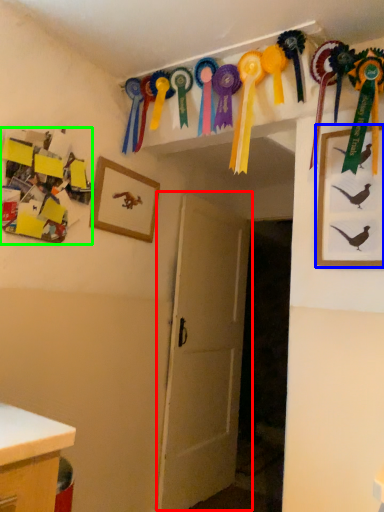
Question: Based on their relative distances, which object is nearer to door (highlighted by a red box)? Choose from picture frame (highlighted by a blue box) and art (highlighted by a green box).

Choices:
 (A) picture frame
 (B) art

Answer: (B)